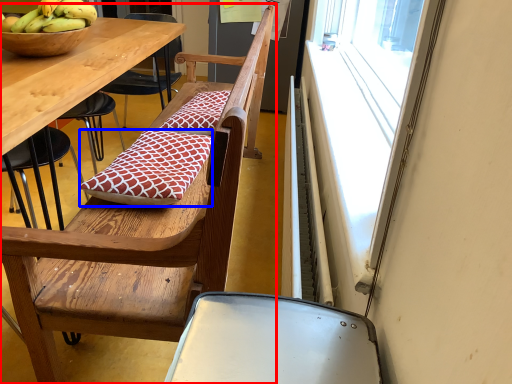
Question: Which object is closer to the camera taking this photo, chair (highlighted by a red box) or pillow (highlighted by a blue box)?

Choices:
 (A) chair
 (B) pillow

Answer: (A)